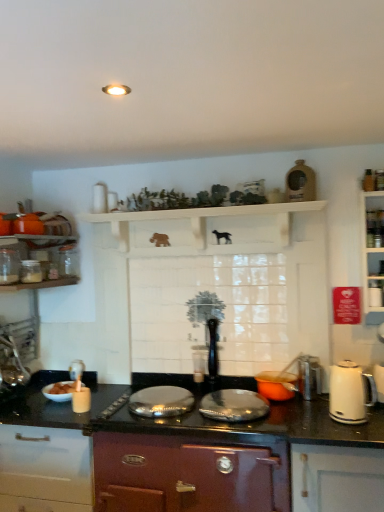
Question: From their relative heights in the image, would you say white wooden shelf at upper center is taller or shorter than clear glass jar at left, the third kitchen appliance when ordered from bottom to top?

Choices:
 (A) short
 (B) tall

Answer: (B)

Question: Considering the positions of white wooden shelf at upper center and clear glass jar at left, the third kitchen appliance when ordered from bottom to top, in the image, is white wooden shelf at upper center bigger or smaller than clear glass jar at left, the third kitchen appliance when ordered from bottom to top,?

Choices:
 (A) big
 (B) small

Answer: (A)

Question: Which is farther from the clear glass jar at left, which is the 1th kitchen appliance in left-to-right order?

Choices:
 (A) black granite countertop at center
 (B) orange matte pot at center, marked as the third kitchen appliance in a left-to-right arrangement
 (C) white glossy bowl at lower left
 (D) clear glass jar at left, which is the third kitchen appliance in right-to-left order
 (E) white glossy jar at upper left

Answer: (B)

Question: Estimate the real-world distances between objects in this image. Which object is farther from the clear glass jar at left, which is the second kitchen appliance in top-to-bottom order?

Choices:
 (A) white glossy jar at upper left
 (B) black granite countertop at center
 (C) white wooden shelf at upper center
 (D) white glossy bowl at lower left
 (E) clear glass jar at left, acting as the 4th kitchen appliance starting from the bottom

Answer: (B)